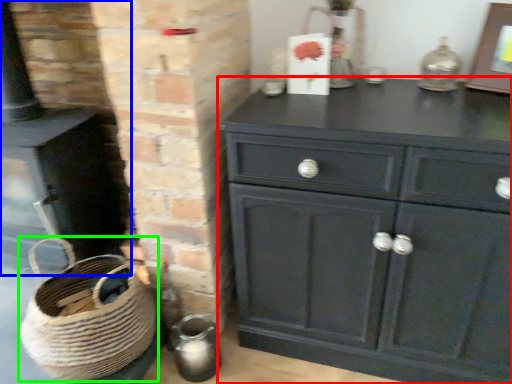
Question: Based on their relative distances, which object is farther from chest of drawers (highlighted by a red box)? Choose from fireplace (highlighted by a blue box) and basket (highlighted by a green box).

Choices:
 (A) fireplace
 (B) basket

Answer: (A)